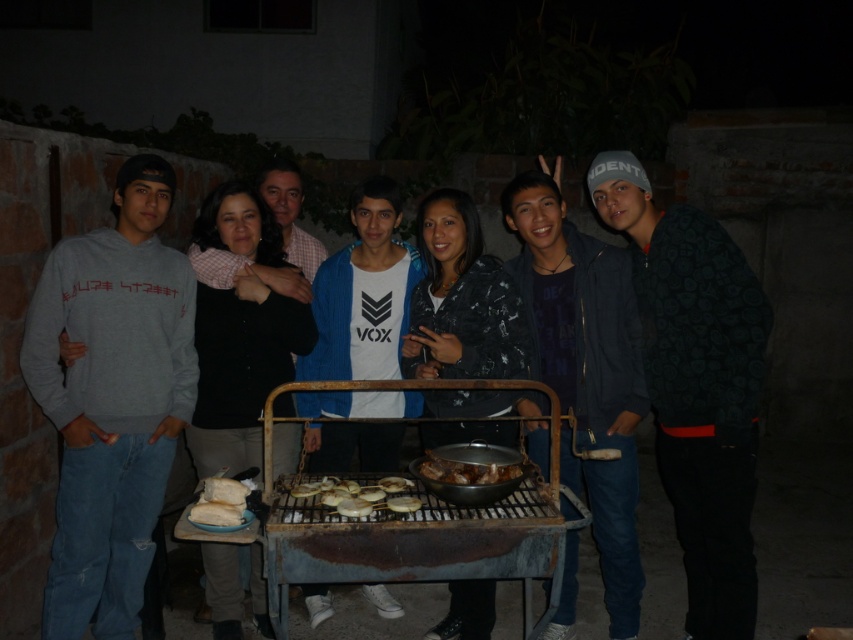
Between rusty metal grill at center and golden crispy onion at center, which one has less height?

golden crispy onion at center is shorter.

Between rusty metal grill at center and golden crispy onion at center, which one is positioned lower?

rusty metal grill at center

Is point (544, 502) less distant than point (399, 476)?

That is True.

Image resolution: width=853 pixels, height=640 pixels. What are the coordinates of `rusty metal grill at center` in the screenshot? It's located at (418, 544).

Who is shorter, dark green textured jacket at right or white matte bread at center?

white matte bread at center

Does dark green textured jacket at right have a smaller size compared to white matte bread at center?

Actually, dark green textured jacket at right might be larger than white matte bread at center.

Is point (654, 257) positioned behind point (355, 500)?

Yes, it is.

Identify the location of dark green textured jacket at right. (695, 385).

Who is more distant from viewer, (x=134, y=476) or (x=721, y=625)?

Positioned behind is point (x=134, y=476).

Is gray sweatshirt at left taller than dark green textured jacket at right?

No, gray sweatshirt at left is not taller than dark green textured jacket at right.

Image resolution: width=853 pixels, height=640 pixels. I want to click on gray sweatshirt at left, so click(x=112, y=400).

Where is `gray sweatshirt at left`? This screenshot has width=853, height=640. gray sweatshirt at left is located at coordinates (112, 400).